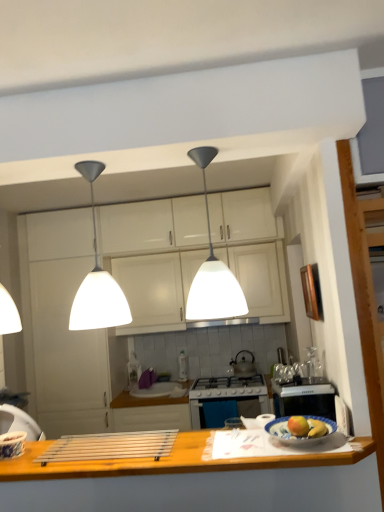
You are a GUI agent. You are given a task and a screenshot of the screen. Output one action in this format:
    pyautogui.click(x=<x>, y=<y>)
    Task: Click on the free space above wooden at lower center (from a real-world perspective)
    The height and width of the screenshot is (512, 384).
    Given the screenshot: What is the action you would take?
    pyautogui.click(x=164, y=445)